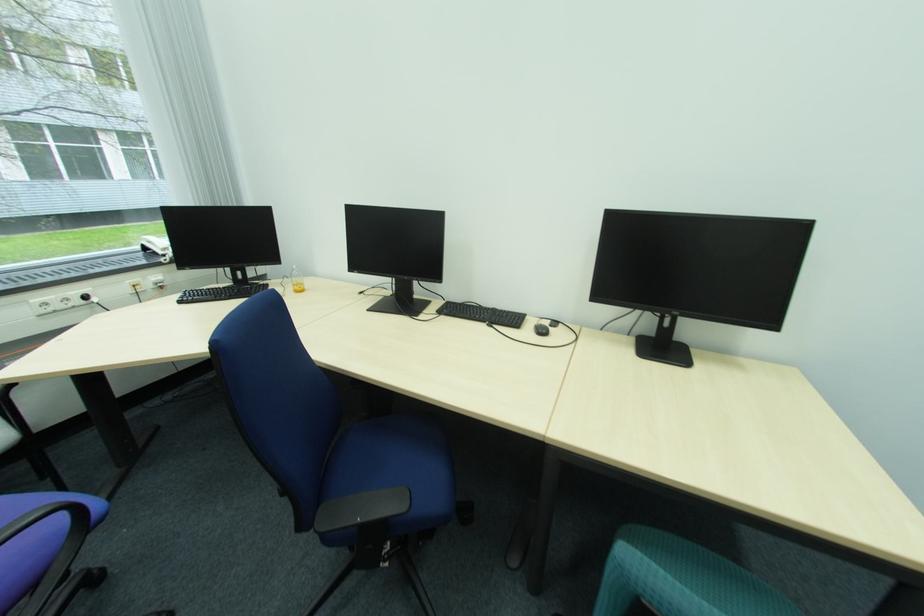
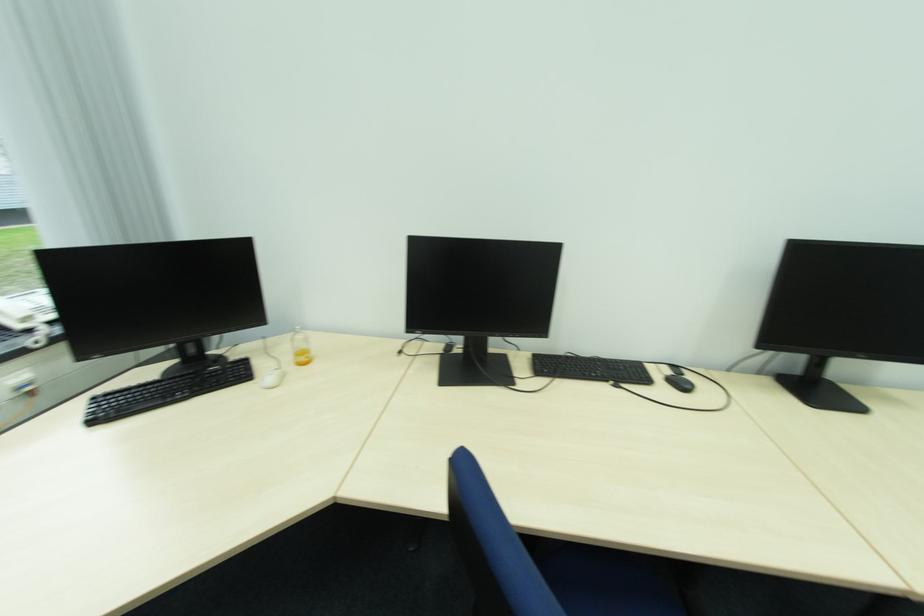
The point at (188, 302) is marked in the first image. Where is the corresponding point in the second image?

(100, 422)